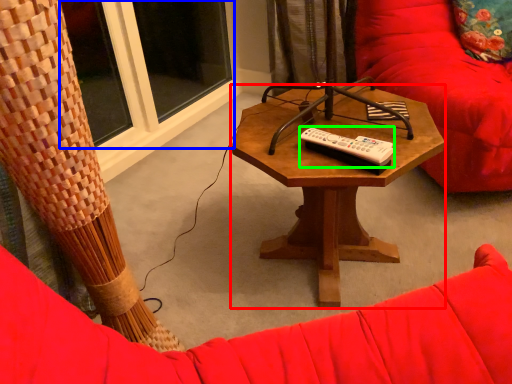
Question: Based on their relative distances, which object is nearer to coffee table (highlighted by a red box)? Choose from window (highlighted by a blue box) and remote (highlighted by a green box).

Choices:
 (A) window
 (B) remote

Answer: (B)